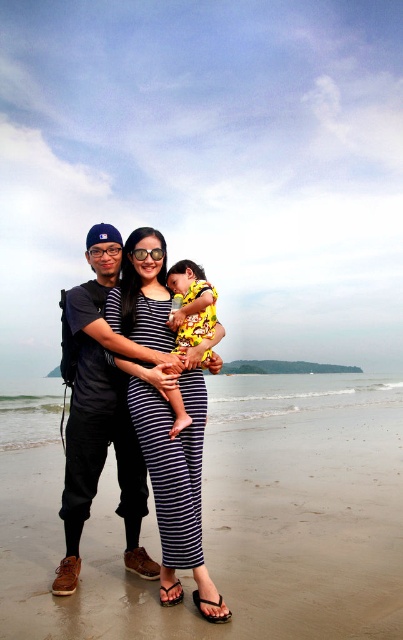
Question: Does brown sand at lower center appear under yellow printed fabric at center?

Choices:
 (A) yes
 (B) no

Answer: (A)

Question: Is striped fabric dress at center to the left of matte black backpack at left from the viewer's perspective?

Choices:
 (A) yes
 (B) no

Answer: (B)

Question: Which is farther from the striped fabric dress at center?

Choices:
 (A) brown sand at lower center
 (B) matte black backpack at left

Answer: (A)

Question: Which of the following is the farthest from the observer?

Choices:
 (A) (228, 515)
 (B) (145, 372)
 (C) (68, 547)
 (D) (195, 333)

Answer: (A)

Question: Is striped fabric dress at center wider than matte black backpack at left?

Choices:
 (A) yes
 (B) no

Answer: (B)

Question: Which point is farther from the camera taking this photo?

Choices:
 (A) (201, 272)
 (B) (297, 515)
 (C) (137, 243)
 (D) (97, 426)

Answer: (B)